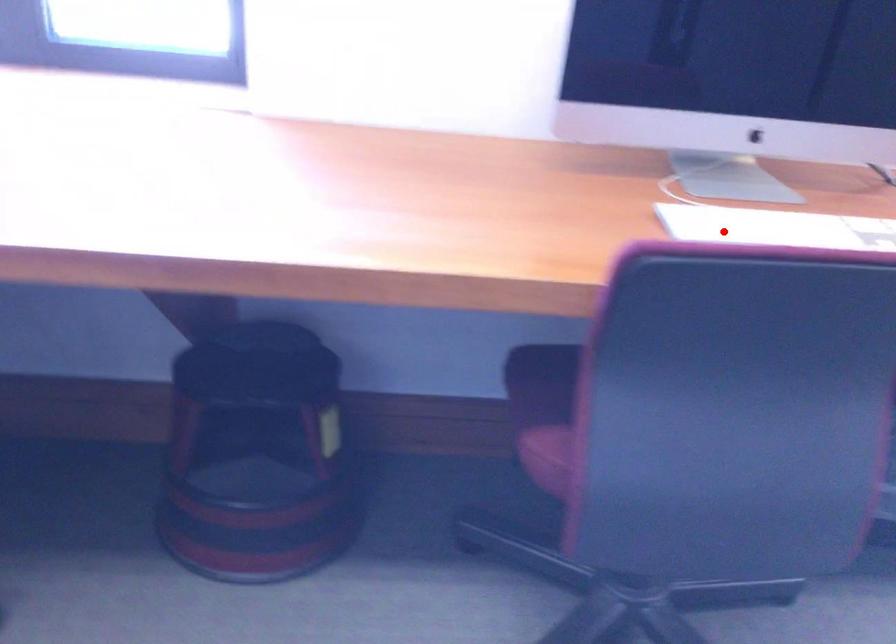
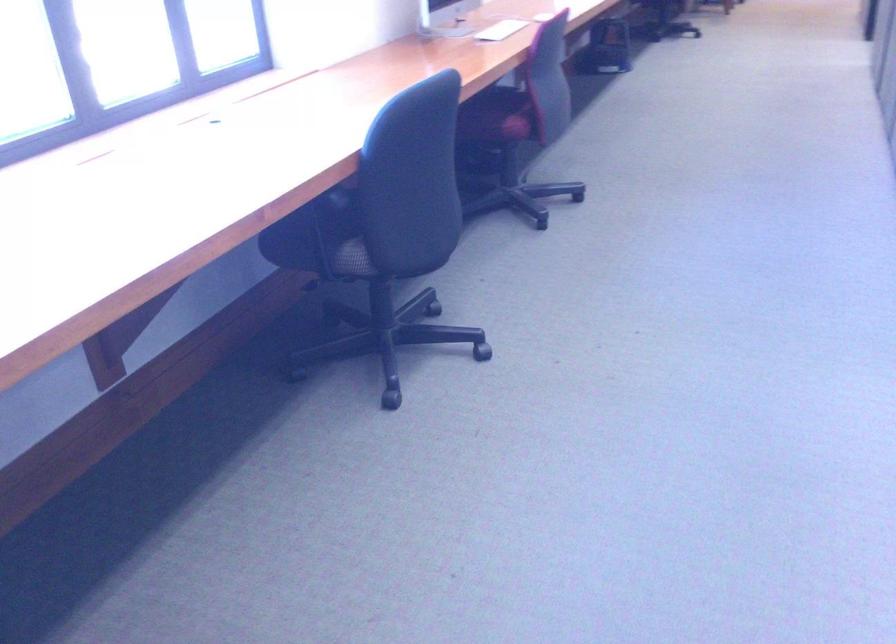
Question: I am providing you with two images of the same scene from different viewpoints. Image1 has a red point marked. In image2, the corresponding 3D location appears at what relative position? Reply with the corresponding letter.

Choices:
 (A) Closer
 (B) Farther

Answer: (B)